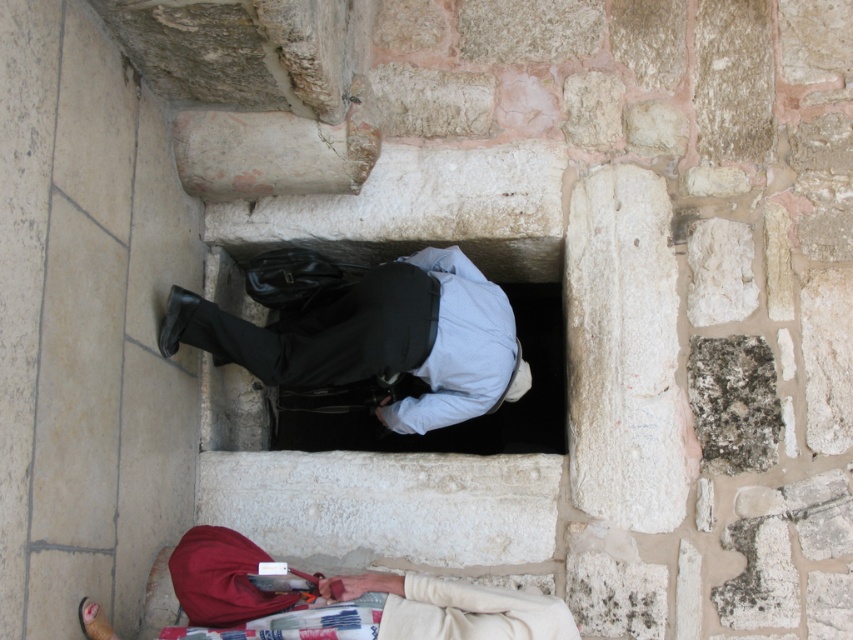
Question: Is light blue fabric shirt at center thinner than beige fabric bag at lower center?

Choices:
 (A) no
 (B) yes

Answer: (B)

Question: Can you confirm if light blue fabric shirt at center is thinner than beige fabric bag at lower center?

Choices:
 (A) no
 (B) yes

Answer: (B)

Question: In this image, where is light blue fabric shirt at center located relative to beige fabric bag at lower center?

Choices:
 (A) below
 (B) above

Answer: (B)